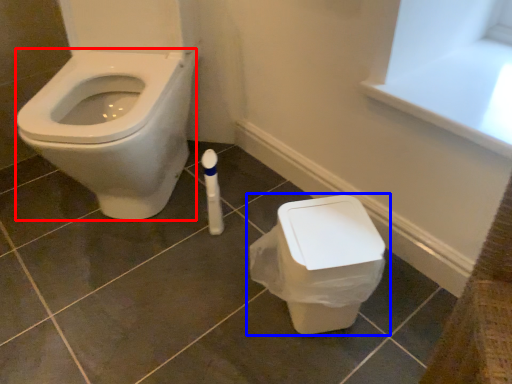
Question: Which of the following is the closest to the observer, bidet (highlighted by a red box) or toilet (highlighted by a blue box)?

Choices:
 (A) bidet
 (B) toilet

Answer: (A)